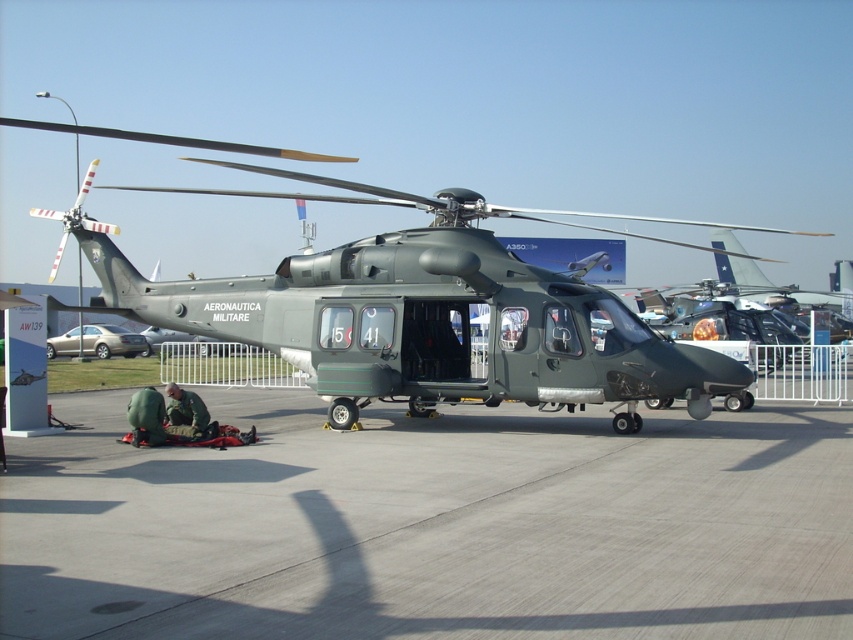
Question: Which is farther from the gray concrete tarmac at center?

Choices:
 (A) matte green helicopter at center
 (B) green fabric uniform at lower left

Answer: (A)

Question: Does matte green helicopter at center appear on the right side of green fabric uniform at lower left?

Choices:
 (A) yes
 (B) no

Answer: (A)

Question: Which point appears closest to the camera in this image?

Choices:
 (A) (318, 316)
 (B) (189, 422)
 (C) (695, 484)

Answer: (C)

Question: Does gray concrete tarmac at center lie in front of matte green helicopter at center?

Choices:
 (A) no
 (B) yes

Answer: (B)

Question: Where is matte green helicopter at center located in relation to green fabric uniform at lower left in the image?

Choices:
 (A) right
 (B) left

Answer: (A)

Question: Based on their relative distances, which object is nearer to the matte green helicopter at center?

Choices:
 (A) gray concrete tarmac at center
 (B) green fabric uniform at lower left

Answer: (A)